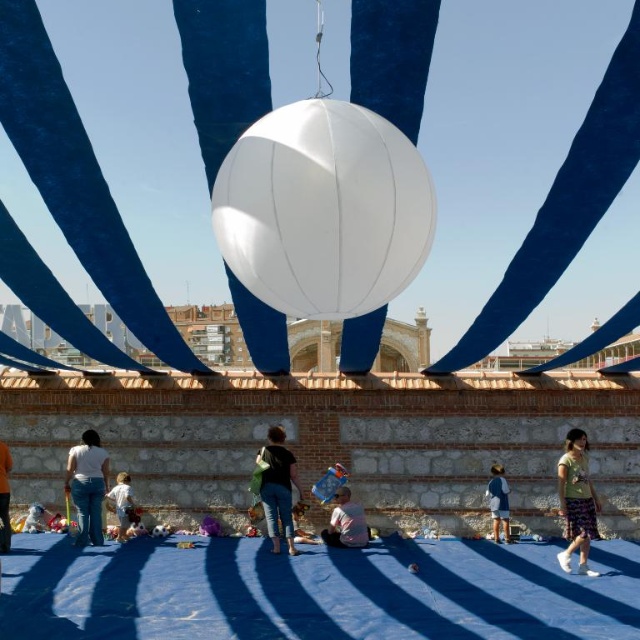
You are organizing an outdoor event and need to place a 1.5 meter wide banner between the white fabric canopy at center and the jeans at center. Is there enough space to fit the banner without overlapping either object?

The distance between the white fabric canopy at center and the jeans at center is 137.59 meters. Since the banner is only 1.5 meters wide, there is more than enough space to place it between them without overlapping either object.

Looking at this image, you are standing at the center of the image and want to pick up both the green cotton shirt at lower right and the orange sweater at lower left. Which item is farther from your current position?

The green cotton shirt at lower right is 127.85 feet away from the orange sweater at lower left, so the green cotton shirt at lower right is farther away from your current position at the center compared to the orange sweater at lower left.